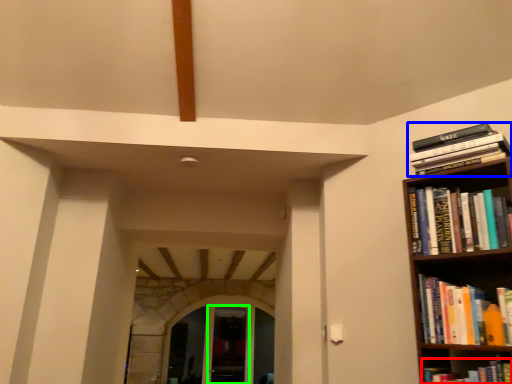
Question: Which object is the closest to the book (highlighted by a red box)? Choose among these: book (highlighted by a blue box) or glass door (highlighted by a green box).

Choices:
 (A) book
 (B) glass door

Answer: (A)